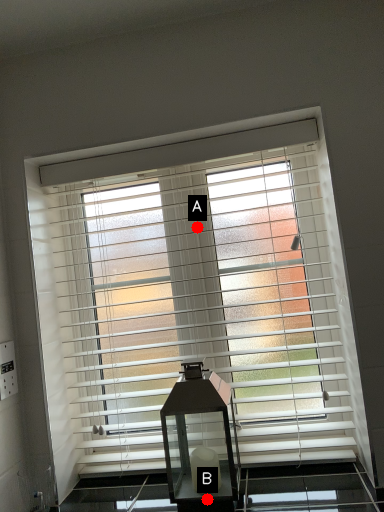
Question: Two points are circled on the image, labeled by A and B beside each circle. Which point is farther from the camera taking this photo?

Choices:
 (A) A is further
 (B) B is further

Answer: (A)